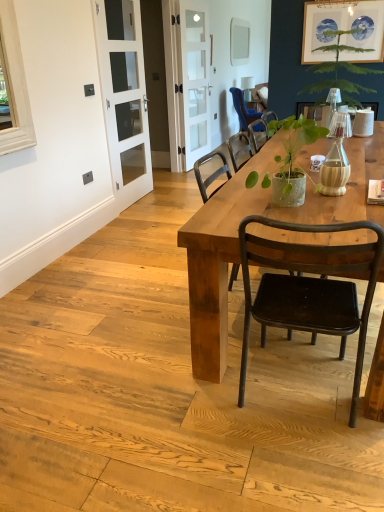
Question: Can you confirm if matte gray power outlet at upper left is bigger than white glass screen door at left, which is counted as the second screen door, starting from the back?

Choices:
 (A) yes
 (B) no

Answer: (B)

Question: Considering the relative sizes of matte gray power outlet at upper left and white glass screen door at left, which is the second screen door in right-to-left order, in the image provided, is matte gray power outlet at upper left smaller than white glass screen door at left, which is the second screen door in right-to-left order,?

Choices:
 (A) yes
 (B) no

Answer: (A)

Question: Is the position of matte gray power outlet at upper left more distant than that of white glass screen door at left, which is the second screen door in right-to-left order?

Choices:
 (A) no
 (B) yes

Answer: (B)

Question: Is matte gray power outlet at upper left taller than white glass screen door at left, which is the second screen door in right-to-left order?

Choices:
 (A) no
 (B) yes

Answer: (A)

Question: Can we say matte gray power outlet at upper left lies outside white glass screen door at left, which ranks as the 1th screen door in left-to-right order?

Choices:
 (A) no
 (B) yes

Answer: (B)

Question: From the image's perspective, does matte gray power outlet at upper left appear higher than white glass screen door at left, which ranks as the 1th screen door in left-to-right order?

Choices:
 (A) yes
 (B) no

Answer: (B)

Question: Could white glass screen door at left, which is counted as the second screen door, starting from the back, be considered to be inside blue fabric chair at upper center, placed as the second chair when sorted from bottom to top?

Choices:
 (A) yes
 (B) no

Answer: (B)

Question: From a real-world perspective, is blue fabric chair at upper center, the first chair in the back-to-front sequence, positioned under white glass screen door at left, which ranks as the 1th screen door in left-to-right order, based on gravity?

Choices:
 (A) no
 (B) yes

Answer: (B)

Question: From a real-world perspective, is blue fabric chair at upper center, which appears as the 1th chair when viewed from the top, on white glass screen door at left, which is the second screen door in right-to-left order?

Choices:
 (A) no
 (B) yes

Answer: (A)

Question: Is there a large distance between blue fabric chair at upper center, placed as the second chair when sorted from bottom to top, and white glass screen door at left, which is the second screen door in right-to-left order?

Choices:
 (A) yes
 (B) no

Answer: (A)

Question: Considering the relative sizes of blue fabric chair at upper center, which appears as the 1th chair when viewed from the top, and white glass screen door at left, which ranks as the 1th screen door in left-to-right order, in the image provided, is blue fabric chair at upper center, which appears as the 1th chair when viewed from the top, shorter than white glass screen door at left, which ranks as the 1th screen door in left-to-right order,?

Choices:
 (A) yes
 (B) no

Answer: (A)

Question: Is blue fabric chair at upper center, placed as the second chair when sorted from bottom to top, to the left of white glass screen door at left, which is counted as the second screen door, starting from the back, from the viewer's perspective?

Choices:
 (A) yes
 (B) no

Answer: (B)

Question: Does clear glass door at center, which ranks as the first screen door in right-to-left order, turn towards blue fabric chair at upper center, the 2th chair from the front?

Choices:
 (A) yes
 (B) no

Answer: (B)